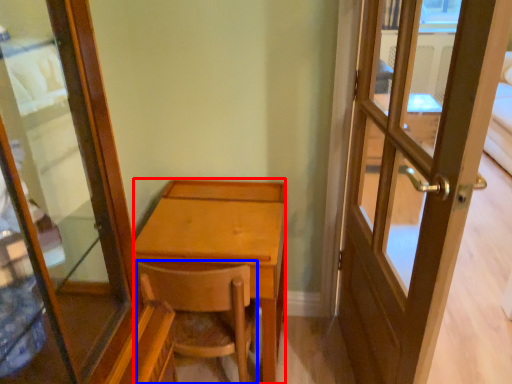
Question: Which point is closer to the camera, desk (highlighted by a red box) or chair (highlighted by a blue box)?

Choices:
 (A) desk
 (B) chair

Answer: (B)